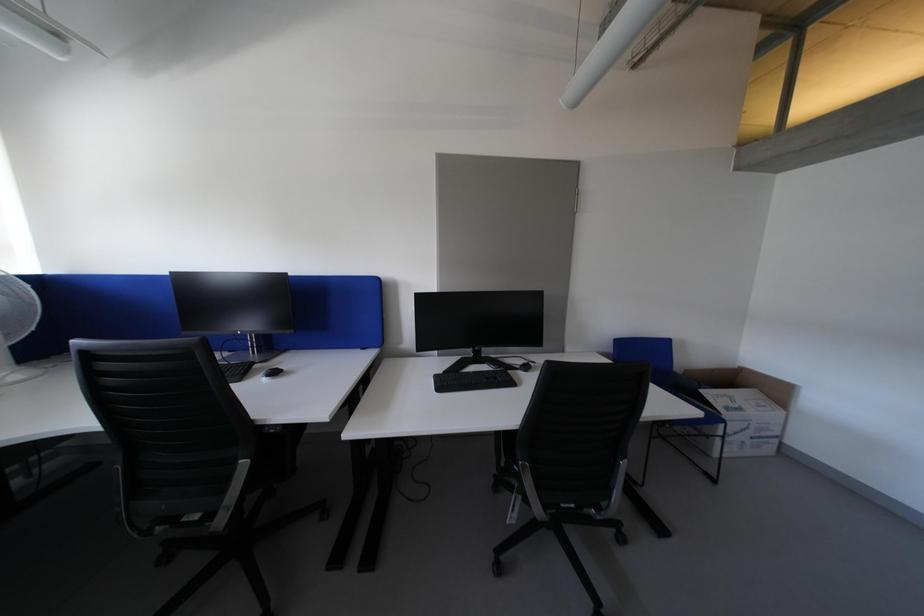
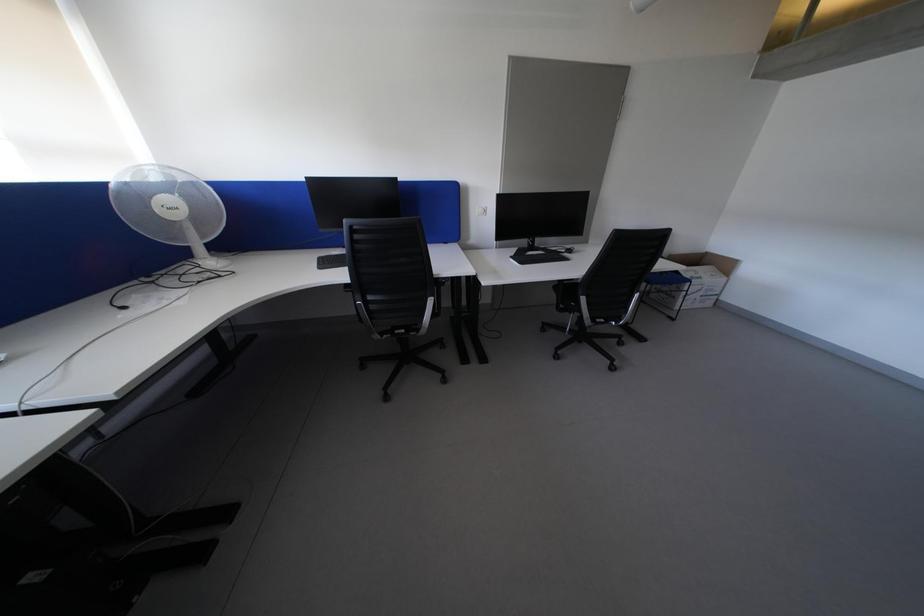
What movement of the cameraman would produce the second image?

The movement direction of the cameraman is left, backward.